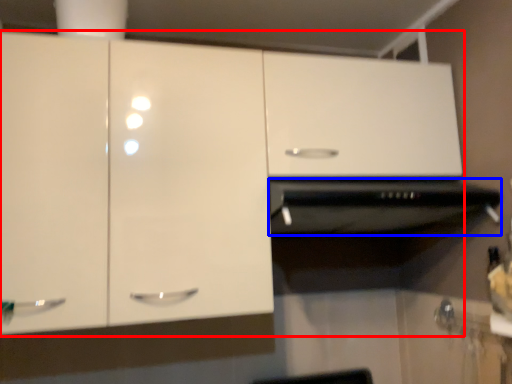
Question: Which object is closer to the camera taking this photo, cabinetry (highlighted by a red box) or vent (highlighted by a blue box)?

Choices:
 (A) cabinetry
 (B) vent

Answer: (A)